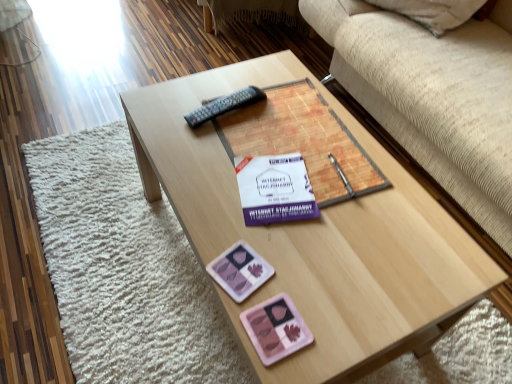
Where is `vacant space in between black plastic remote at center and pink matte palette at center, which ranks as the second currency in top-to-bottom order`? The height and width of the screenshot is (384, 512). vacant space in between black plastic remote at center and pink matte palette at center, which ranks as the second currency in top-to-bottom order is located at coordinates pyautogui.click(x=245, y=193).